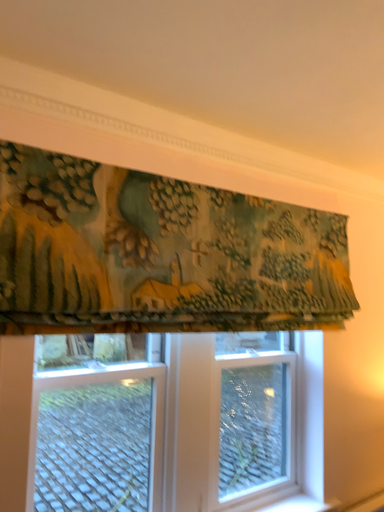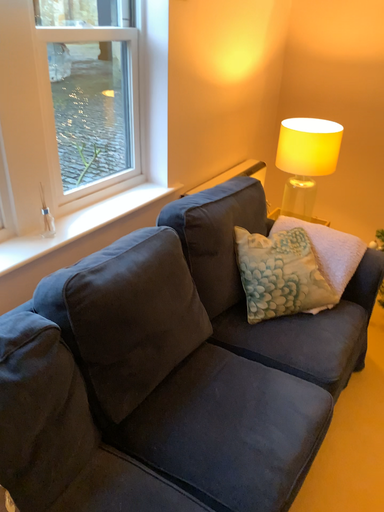
Question: Which way did the camera rotate in the video?

Choices:
 (A) rotated left
 (B) rotated right

Answer: (B)